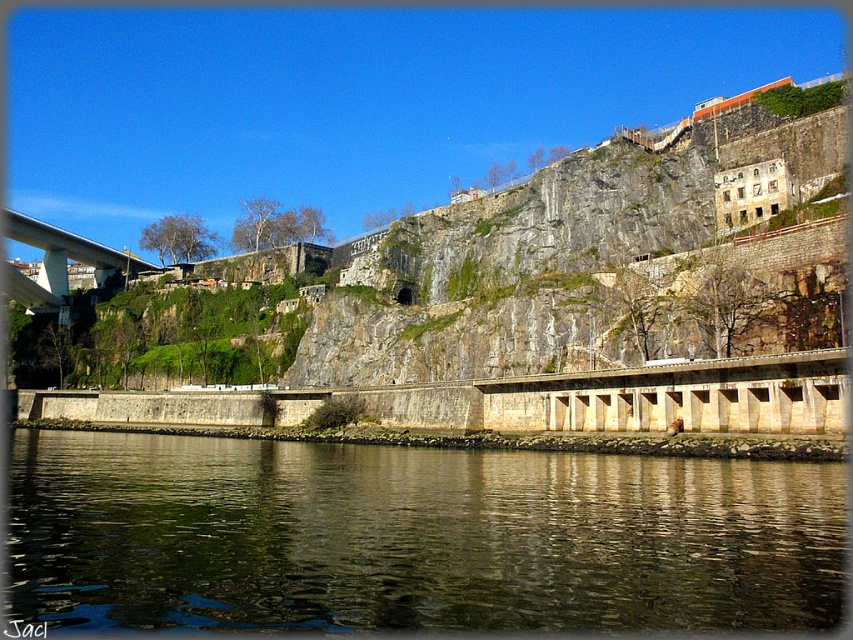
Can you confirm if dark reflective water at lower center is shorter than concrete bridge at left?

Correct, dark reflective water at lower center is not as tall as concrete bridge at left.

Looking at this image, does dark reflective water at lower center come in front of concrete bridge at left?

Yes, it is.

Is point (299, 515) in front of point (61, 252)?

Yes, point (299, 515) is closer to viewer.

Identify the location of dark reflective water at lower center. The width and height of the screenshot is (853, 640). (415, 538).